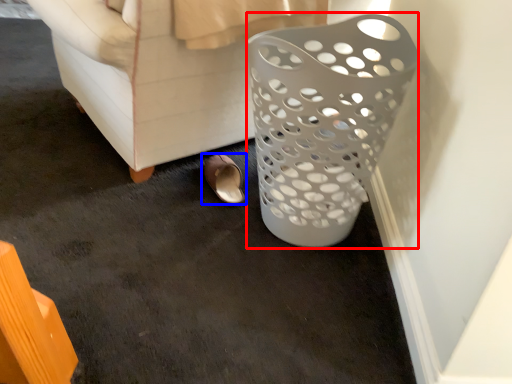
Question: Which point is closer to the camera, basket (highlighted by a red box) or footwear (highlighted by a blue box)?

Choices:
 (A) basket
 (B) footwear

Answer: (A)